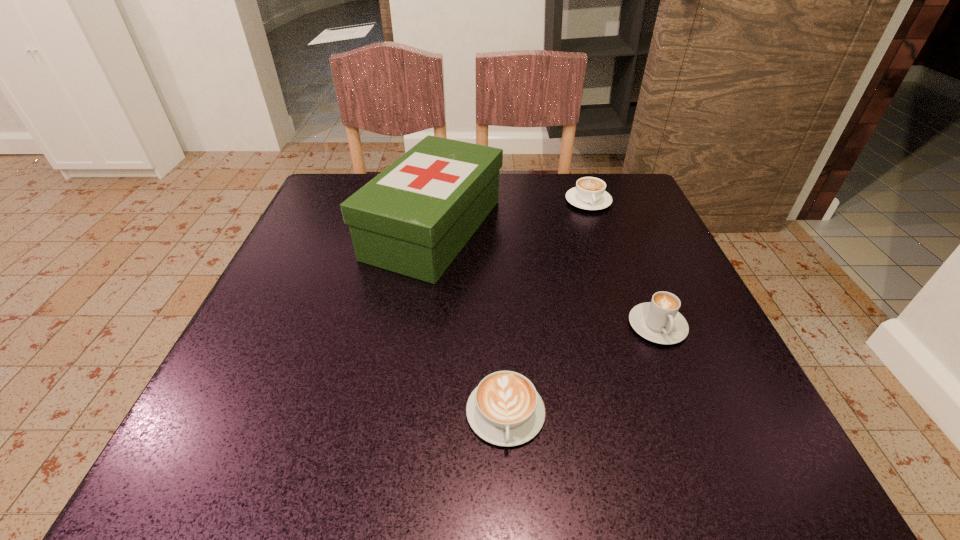
Image resolution: width=960 pixels, height=540 pixels. I want to click on cappuccino that is positioned at the far edge, so click(x=589, y=193).

You are a GUI agent. You are given a task and a screenshot of the screen. Output one action in this format:
    pyautogui.click(x=<x>, y=<y>)
    Task: Click on the object located at the near edge
    
    Given the screenshot: What is the action you would take?
    pyautogui.click(x=505, y=409)

You are a GUI agent. You are given a task and a screenshot of the screen. Output one action in this format:
    pyautogui.click(x=<x>, y=<y>)
    Task: Click on the object at the left edge
    This screenshot has height=540, width=960.
    Given the screenshot: What is the action you would take?
    pyautogui.click(x=413, y=218)

Locate an element on the screen. object at the far left corner is located at coordinates (413, 218).

The height and width of the screenshot is (540, 960). Find the location of `object at the far right corner`. object at the far right corner is located at coordinates (589, 193).

In the image, there is a desktop. At what (x,y) coordinates should I click in order to perform the action: click on vacant space at the far edge. Please return your answer as a coordinate pair (x, y). The image size is (960, 540). Looking at the image, I should click on (569, 215).

This screenshot has width=960, height=540. In order to click on vacant space at the near edge of the desktop in this screenshot , I will do `click(600, 465)`.

In the image, there is a desktop. Where is `blank space at the left edge`? Image resolution: width=960 pixels, height=540 pixels. blank space at the left edge is located at coordinates (244, 373).

The image size is (960, 540). Find the location of `vacant space at the right edge of the desktop`. vacant space at the right edge of the desktop is located at coordinates (635, 375).

Find the location of a particular element. blank space at the near left corner of the desktop is located at coordinates (276, 436).